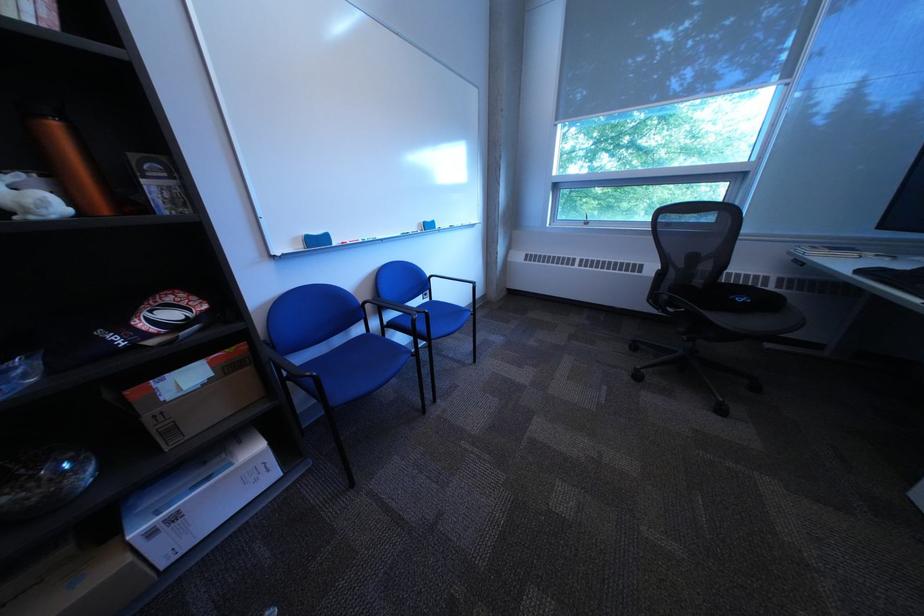
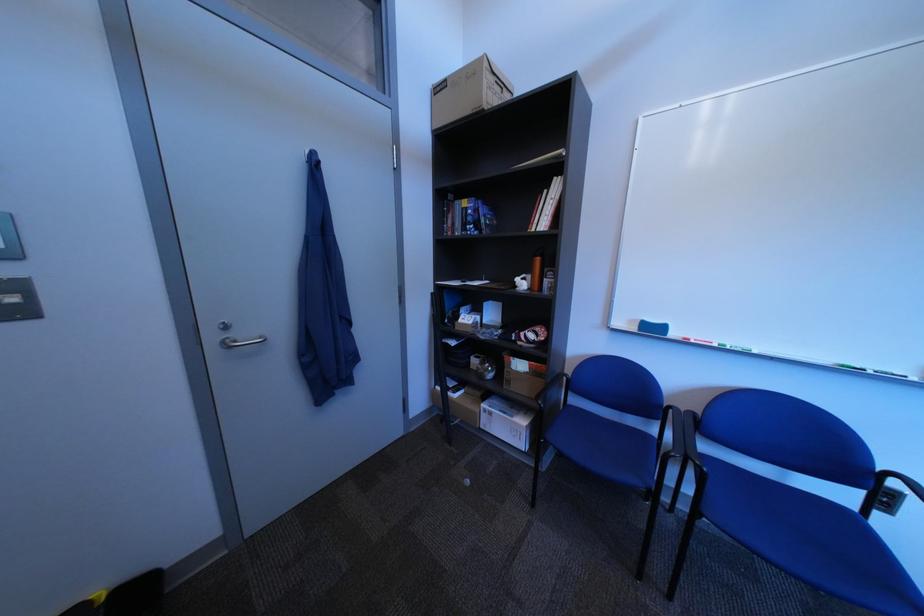
Locate, in the second image, the point that corresponds to point (382, 307) in the first image.

(687, 413)